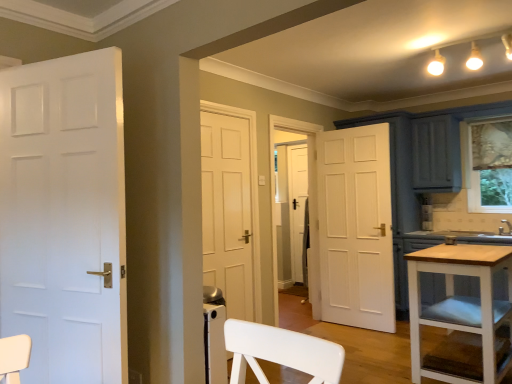
This screenshot has width=512, height=384. What do you see at coordinates (461, 306) in the screenshot?
I see `white wood table at lower right` at bounding box center [461, 306].

What are the coordinates of `white wood table at lower right` in the screenshot? It's located at (461, 306).

Where is `white matte door at left`? white matte door at left is located at coordinates (64, 217).

What do you see at coordinates (64, 217) in the screenshot? This screenshot has width=512, height=384. I see `white matte door at left` at bounding box center [64, 217].

Locate an element on the screen. This screenshot has width=512, height=384. white wood table at lower right is located at coordinates (461, 306).

Between white matte door at left and white wood table at lower right, which one appears on the right side from the viewer's perspective?

Positioned to the right is white wood table at lower right.

Is white matte door at left in front of white wood table at lower right?

Yes, it is in front of white wood table at lower right.

Which is nearer, (120, 92) or (454, 247)?

The point (120, 92) is more forward.

From the image's perspective, is white matte door at left located above or below white wood table at lower right?

white matte door at left is above white wood table at lower right.

From a real-world perspective, between white matte door at left and white wood table at lower right, who is vertically lower?

white wood table at lower right, from a real-world perspective.

Can you confirm if white matte door at left is wider than white wood table at lower right?

Incorrect, the width of white matte door at left does not surpass that of white wood table at lower right.

Considering the sizes of objects white matte door at left and white wood table at lower right in the image provided, who is taller, white matte door at left or white wood table at lower right?

white matte door at left.

Who is bigger, white matte door at left or white wood table at lower right?

white wood table at lower right is bigger.

Based on the photo, would you say white wood table at lower right is part of white matte door at left's contents?

No, white matte door at left does not contain white wood table at lower right.

Is white matte door at left next to white wood table at lower right and touching it?

white matte door at left is not next to white wood table at lower right, and they're not touching.

Is white matte door at left oriented away from white wood table at lower right?

No, white wood table at lower right is not at the back of white matte door at left.

What's the angular difference between white matte door at left and white wood table at lower right's facing directions?

The angular difference between white matte door at left and white wood table at lower right is 107 degrees.

The width and height of the screenshot is (512, 384). I want to click on table below the white matte door at left (from the image's perspective), so click(x=461, y=306).

Considering the positions of objects white wood table at lower right and white matte door at left in the image provided, who is more to the left, white wood table at lower right or white matte door at left?

From the viewer's perspective, white matte door at left appears more on the left side.

Is white wood table at lower right behind white matte door at left?

Yes, white wood table at lower right is behind white matte door at left.

Between point (449, 300) and point (46, 335), which one is positioned behind?

The point (449, 300) is more distant.

From the image's perspective, is white wood table at lower right above or below white matte door at left?

white wood table at lower right is below white matte door at left.

Looking at this image, from a real-world perspective, is white wood table at lower right positioned over white matte door at left based on gravity?

No.

Does white wood table at lower right have a lesser width compared to white matte door at left?

In fact, white wood table at lower right might be wider than white matte door at left.

In terms of height, does white wood table at lower right look taller or shorter compared to white matte door at left?

Clearly, white wood table at lower right is shorter compared to white matte door at left.

Is white wood table at lower right bigger than white matte door at left?

Indeed, white wood table at lower right has a larger size compared to white matte door at left.

Is white wood table at lower right positioned beyond the bounds of white matte door at left?

Indeed, white wood table at lower right is completely outside white matte door at left.

Looking at this image, is there a large distance between white wood table at lower right and white matte door at left?

Yes, white wood table at lower right and white matte door at left are located far from each other.

Could you tell me if white wood table at lower right is turned towards white matte door at left?

No, white wood table at lower right is not oriented towards white matte door at left.

How different are the orientations of white wood table at lower right and white matte door at left in degrees?

They differ by 107 degrees in their facing directions.

How far apart are white wood table at lower right and white matte door at left?

white wood table at lower right and white matte door at left are 7.06 feet apart from each other.

Locate an element on the screen. The height and width of the screenshot is (384, 512). table to the right of white matte door at left is located at coordinates (461, 306).

Locate an element on the screen. table that is below the white matte door at left (from the image's perspective) is located at coordinates (461, 306).

Locate an element on the screen. The height and width of the screenshot is (384, 512). door above the white wood table at lower right (from the image's perspective) is located at coordinates (64, 217).